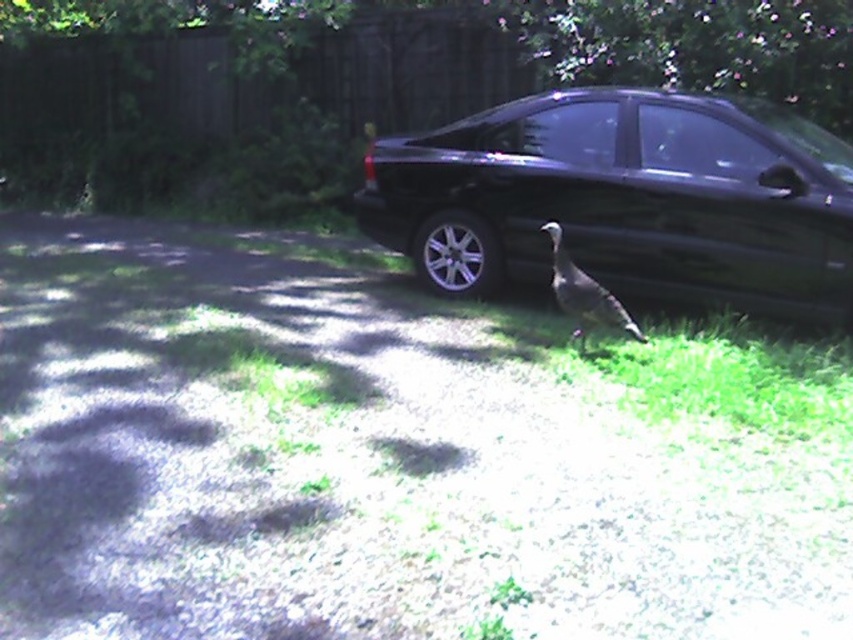
Is black metallic car at center smaller than gray feathered bird at center?

Incorrect, black metallic car at center is not smaller in size than gray feathered bird at center.

What do you see at coordinates (625, 198) in the screenshot?
I see `black metallic car at center` at bounding box center [625, 198].

Does point (422, 145) come farther from viewer compared to point (561, 278)?

Yes, point (422, 145) is farther from viewer.

At what (x,y) coordinates should I click in order to perform the action: click on black metallic car at center. Please return your answer as a coordinate pair (x, y). The height and width of the screenshot is (640, 853). Looking at the image, I should click on (625, 198).